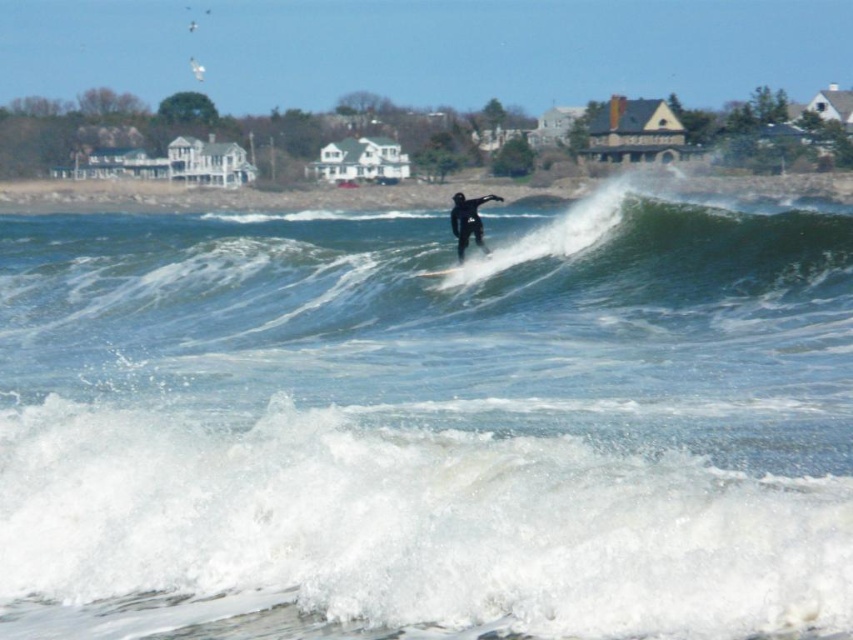
Question: In this image, where is clear blue water at wave center located relative to black matte wetsuit at center?

Choices:
 (A) right
 (B) left

Answer: (A)

Question: Where is black matte wetsuit at center located in relation to smooth black surfboard at center in the image?

Choices:
 (A) above
 (B) below

Answer: (A)

Question: Can you confirm if clear blue water at wave center is smaller than black matte wetsuit at center?

Choices:
 (A) no
 (B) yes

Answer: (A)

Question: Which point is closer to the camera taking this photo?

Choices:
 (A) (338, 563)
 (B) (415, 275)

Answer: (A)

Question: Which object appears farthest from the camera in this image?

Choices:
 (A) clear blue water at wave center
 (B) black matte wetsuit at center

Answer: (B)

Question: Which object appears closest to the camera in this image?

Choices:
 (A) smooth black surfboard at center
 (B) clear blue water at wave center
 (C) black matte wetsuit at center

Answer: (B)